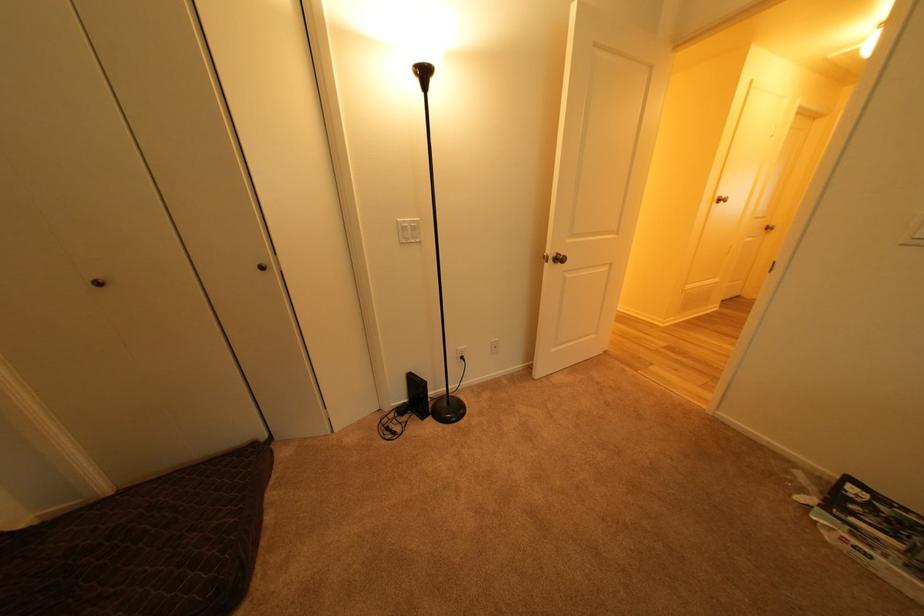
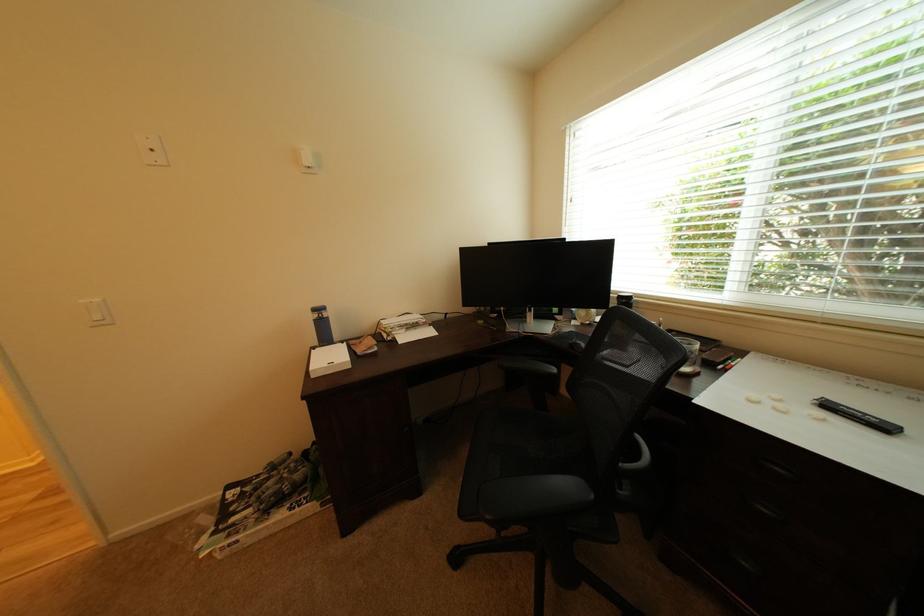
Question: The camera is either moving clockwise (left) or counter-clockwise (right) around the object. The first image is from the beginning of the video and the second image is from the end. Is the camera moving left or right when shooting the video?

Choices:
 (A) Left
 (B) Right

Answer: (A)